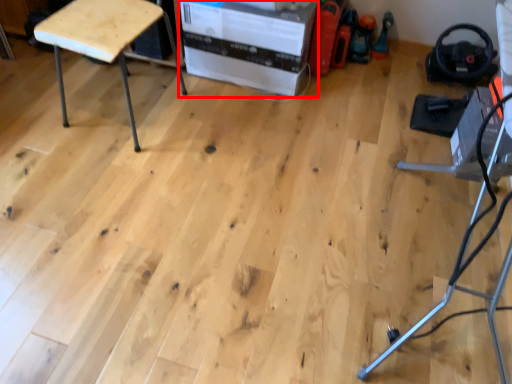
Question: Observing the image, what is the correct spatial positioning of cardboard box (annotated by the red box) in reference to furniture?

Choices:
 (A) right
 (B) left

Answer: (A)